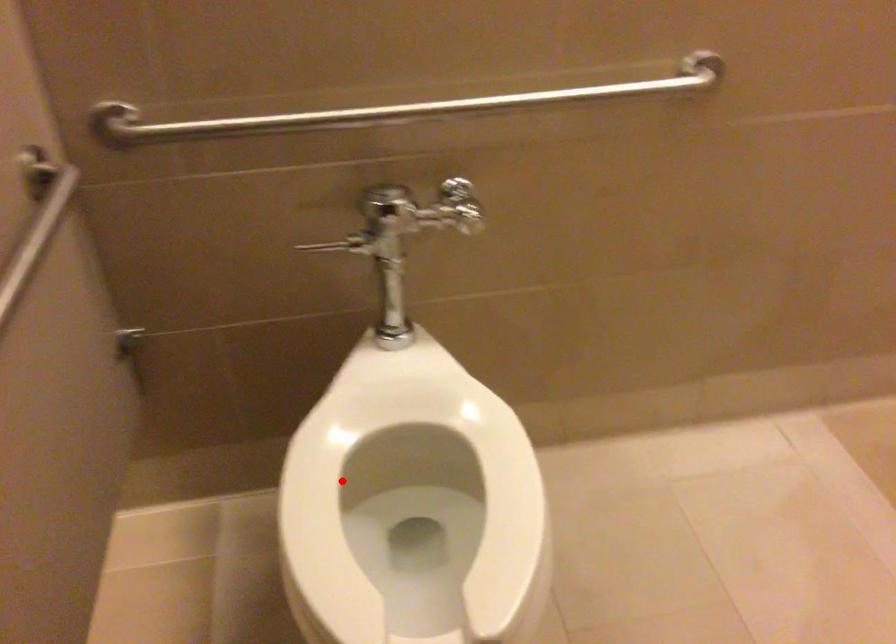
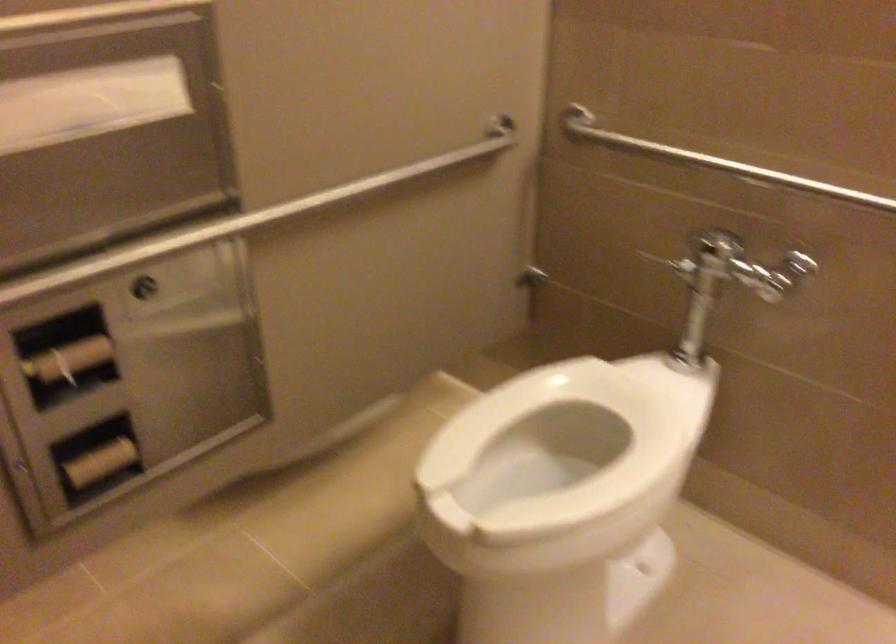
Question: I am providing you with two images of the same scene from different viewpoints. Given a red point in image1, look at the same physical point in image2. Is it:

Choices:
 (A) Closer to the viewpoint
 (B) Farther from the viewpoint

Answer: (B)